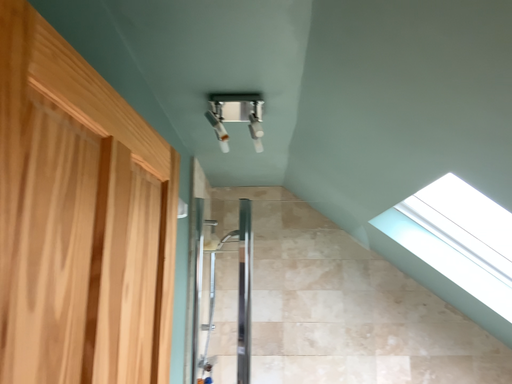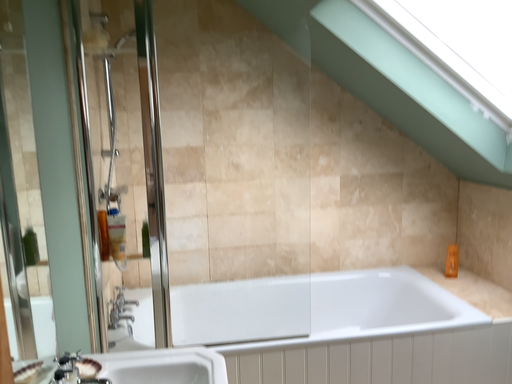
Question: How did the camera likely rotate when shooting the video?

Choices:
 (A) rotated downward
 (B) rotated upward

Answer: (A)